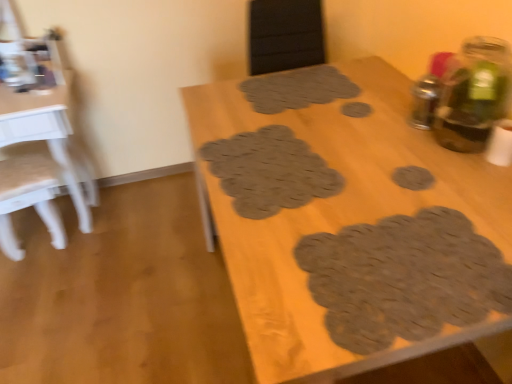
The height and width of the screenshot is (384, 512). In order to click on free space in front of metallic silver bottle at upper right, the second bottle viewed from the front in this screenshot , I will do `click(430, 153)`.